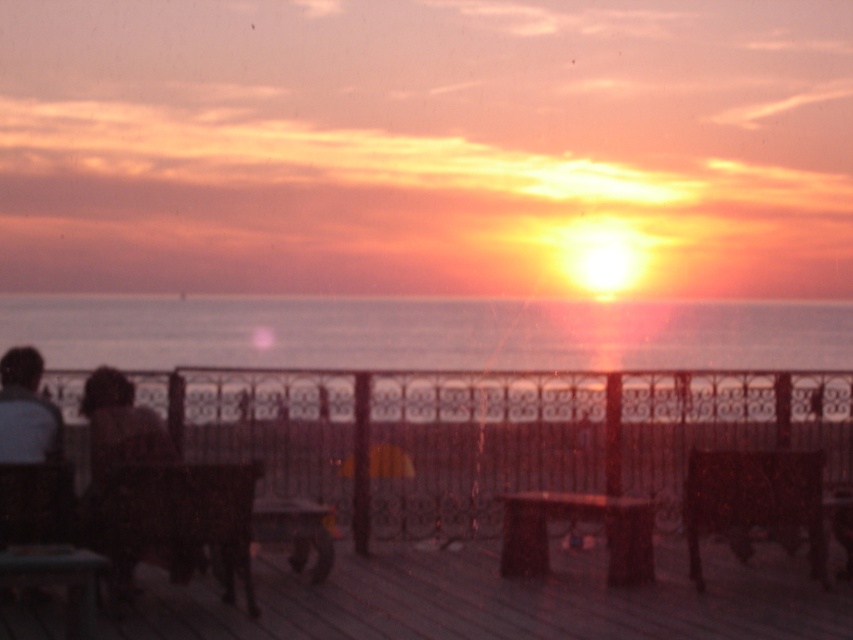
Does metallic ornate railing at center have a lesser width compared to wooden dock at center?

In fact, metallic ornate railing at center might be wider than wooden dock at center.

Consider the image. Can you confirm if metallic ornate railing at center is shorter than wooden dock at center?

Incorrect, metallic ornate railing at center's height does not fall short of wooden dock at center's.

Is point (570, 449) closer to camera compared to point (515, 557)?

No, (570, 449) is further to viewer.

This screenshot has width=853, height=640. What are the coordinates of `metallic ornate railing at center` in the screenshot? It's located at (492, 433).

In the scene shown: Which is below, metallic ornate railing at center or smooth ocean water at center?

metallic ornate railing at center is below.

Locate an element on the screen. metallic ornate railing at center is located at coordinates (492, 433).

Measure the distance between smooth ocean water at center and camera.

They are 29.58 feet apart.

This screenshot has width=853, height=640. What do you see at coordinates (425, 333) in the screenshot? I see `smooth ocean water at center` at bounding box center [425, 333].

Which is behind, point (83, 362) or point (22, 374)?

The point (83, 362) is behind.

Locate an element on the screen. This screenshot has height=640, width=853. smooth ocean water at center is located at coordinates (425, 333).